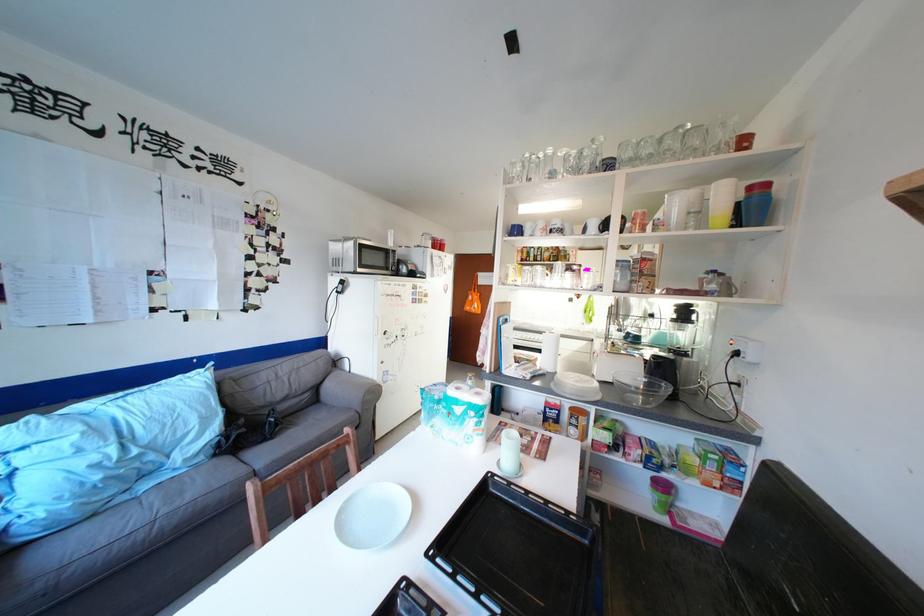
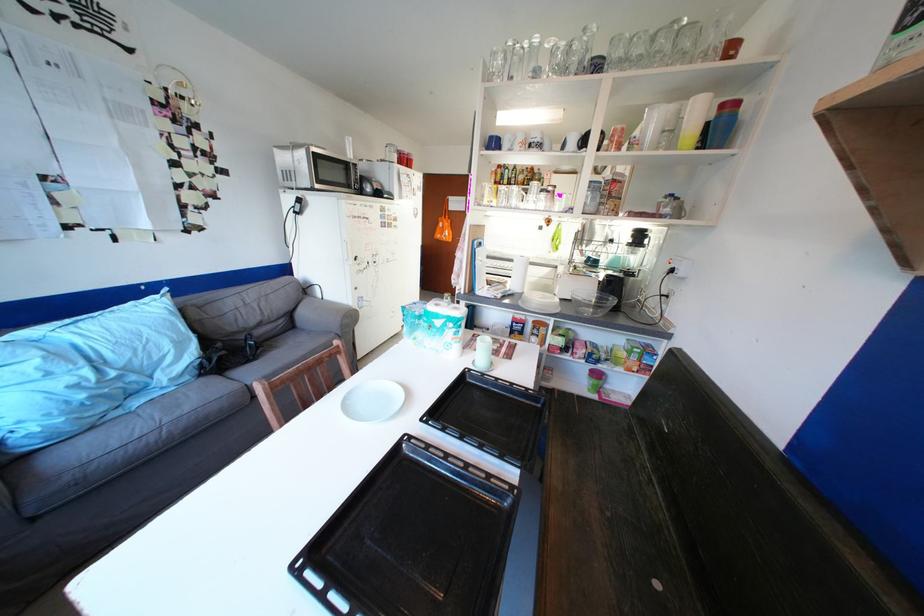
In the second image, find the point that corresponds to the point at 543,361 in the first image.

(514, 284)